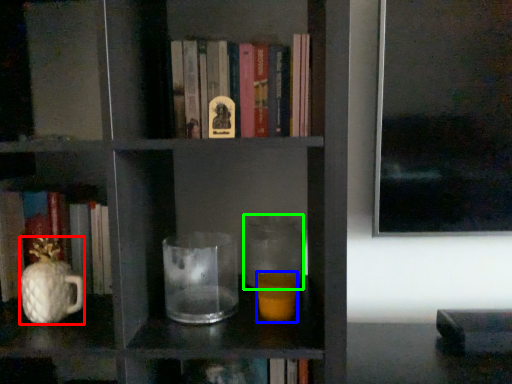
Question: Based on their relative distances, which object is nearer to glass vase (highlighted by a red box)? Choose from candle holder (highlighted by a blue box) and glass jar (highlighted by a green box).

Choices:
 (A) candle holder
 (B) glass jar

Answer: (A)